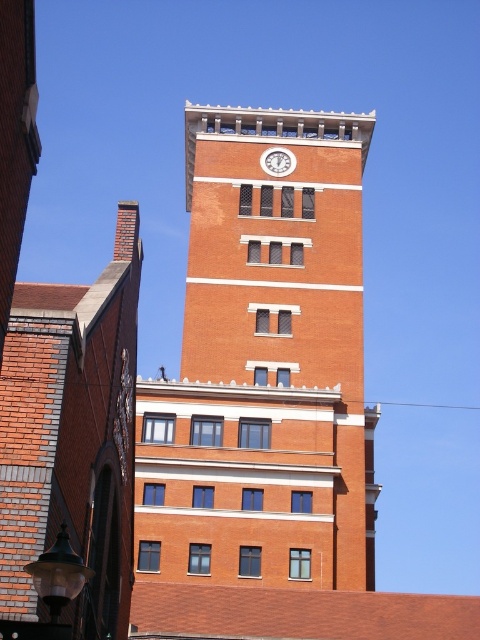
Who is shorter, brick clock tower at center or white glossy clock at upper center?

white glossy clock at upper center

How distant is brick clock tower at center from white glossy clock at upper center?

brick clock tower at center is 43.86 feet away from white glossy clock at upper center.

Does point (288, 508) come farther from viewer compared to point (272, 150)?

No.

Find the location of a particular element. This screenshot has height=640, width=480. brick clock tower at center is located at coordinates (264, 364).